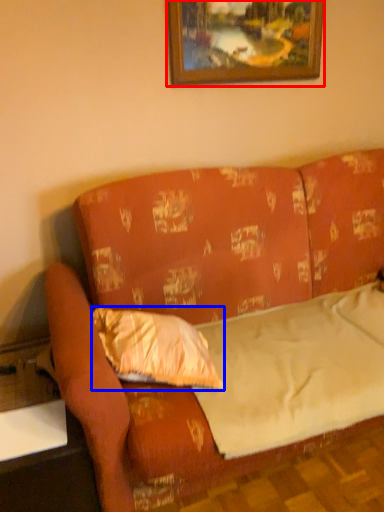
Question: Which of the following is the closest to the observer, picture frame (highlighted by a red box) or pillow (highlighted by a blue box)?

Choices:
 (A) picture frame
 (B) pillow

Answer: (B)